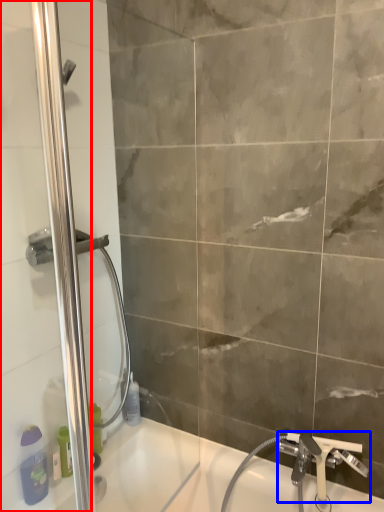
Question: Which of the following is the farthest to the observer, screen door (highlighted by a red box) or tap (highlighted by a blue box)?

Choices:
 (A) screen door
 (B) tap

Answer: (B)